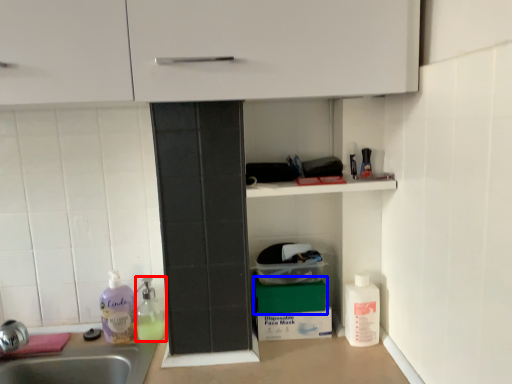
Question: Which point is closer to the camera, cleaning product (highlighted by a red box) or box (highlighted by a blue box)?

Choices:
 (A) cleaning product
 (B) box

Answer: (B)